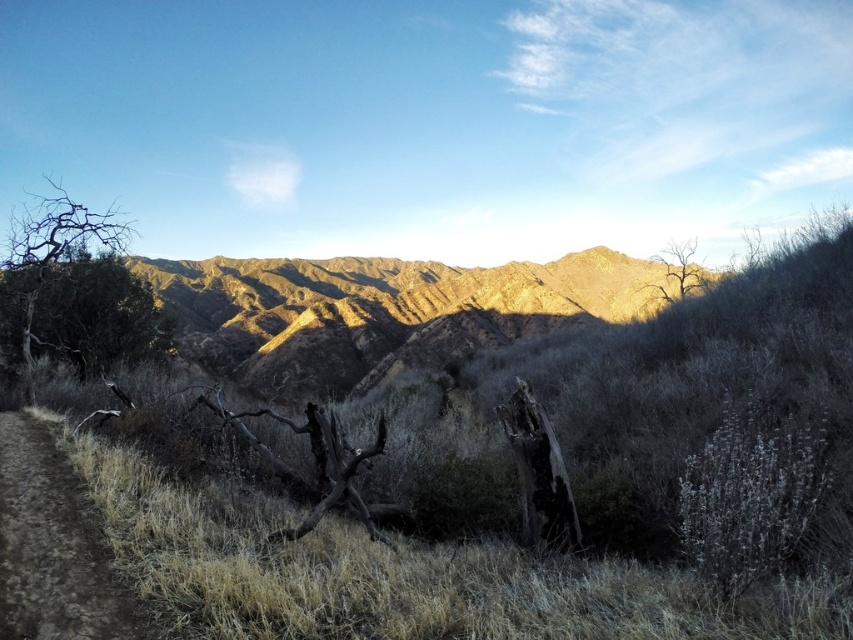
Who is lower down, brown dirt track at lower left or bare wood tree at upper right?

brown dirt track at lower left is below.

Who is higher up, brown dirt track at lower left or bare wood tree at upper right?

bare wood tree at upper right is higher up.

Does point (71, 580) come farther from viewer compared to point (706, 276)?

No, it is not.

Where is `brown dirt track at lower left`? Image resolution: width=853 pixels, height=640 pixels. brown dirt track at lower left is located at coordinates (53, 547).

How distant is brown rocky mountain range at center from bare wood tree at left?

brown rocky mountain range at center and bare wood tree at left are 236.66 meters apart.

This screenshot has width=853, height=640. I want to click on brown rocky mountain range at center, so click(379, 310).

Is the position of brown dirt track at lower left less distant than that of bare wood tree at left?

Yes, it is in front of bare wood tree at left.

Who is taller, brown dirt track at lower left or bare wood tree at left?

Standing taller between the two is bare wood tree at left.

Describe the element at coordinates (53, 547) in the screenshot. I see `brown dirt track at lower left` at that location.

Where is `brown dirt track at lower left`? The height and width of the screenshot is (640, 853). brown dirt track at lower left is located at coordinates (53, 547).